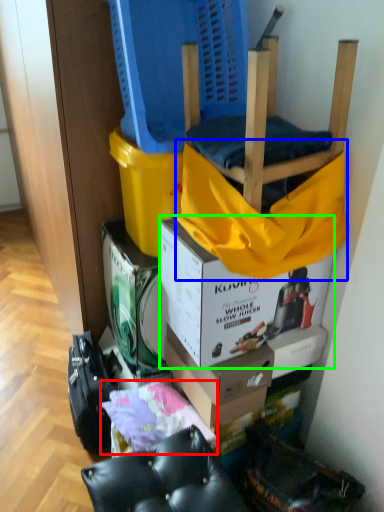
Question: Considering the real-world distances, which object is farthest from material (highlighted by a red box)? blanket (highlighted by a blue box) or box (highlighted by a green box)?

Choices:
 (A) blanket
 (B) box

Answer: (A)